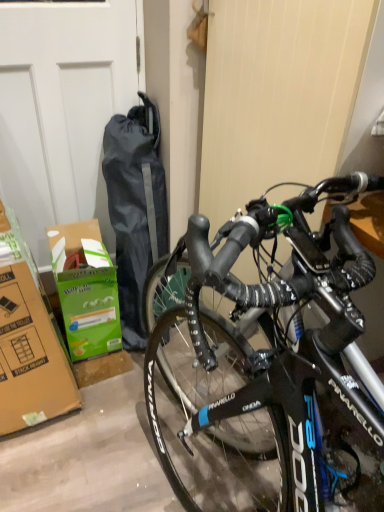
Question: Which is correct: green cardboard box at lower left is inside white matte garage door at upper left, or outside of it?

Choices:
 (A) inside
 (B) outside

Answer: (B)

Question: Based on their sizes in the image, would you say green cardboard box at lower left is bigger or smaller than white matte garage door at upper left?

Choices:
 (A) big
 (B) small

Answer: (B)

Question: Relative to white matte garage door at upper left, is green cardboard box at lower left in front or behind?

Choices:
 (A) behind
 (B) front

Answer: (A)

Question: From the image's perspective, relative to green cardboard box at lower left, is white matte garage door at upper left above or below?

Choices:
 (A) below
 (B) above

Answer: (B)

Question: Is white matte garage door at upper left bigger or smaller than green cardboard box at lower left?

Choices:
 (A) big
 (B) small

Answer: (A)

Question: From a real-world perspective, is white matte garage door at upper left above or below green cardboard box at lower left?

Choices:
 (A) above
 (B) below

Answer: (A)

Question: In the image, is white matte garage door at upper left on the left side or the right side of green cardboard box at lower left?

Choices:
 (A) right
 (B) left

Answer: (B)